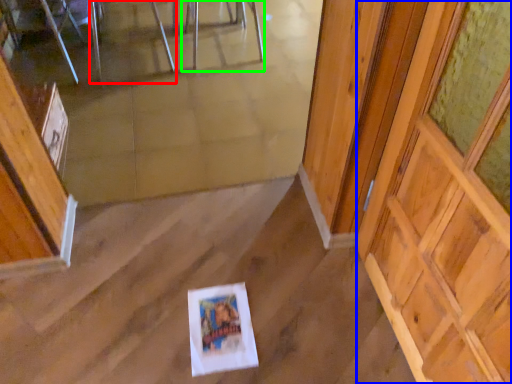
Question: Based on their relative distances, which object is farther from chair (highlighted by a red box)? Choose from barn door (highlighted by a blue box) and chair (highlighted by a green box).

Choices:
 (A) barn door
 (B) chair

Answer: (A)